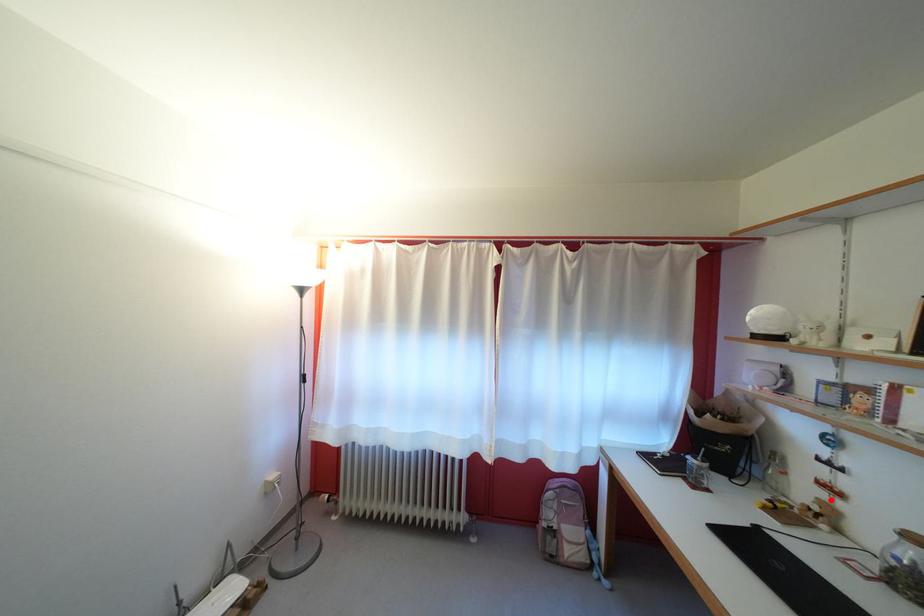
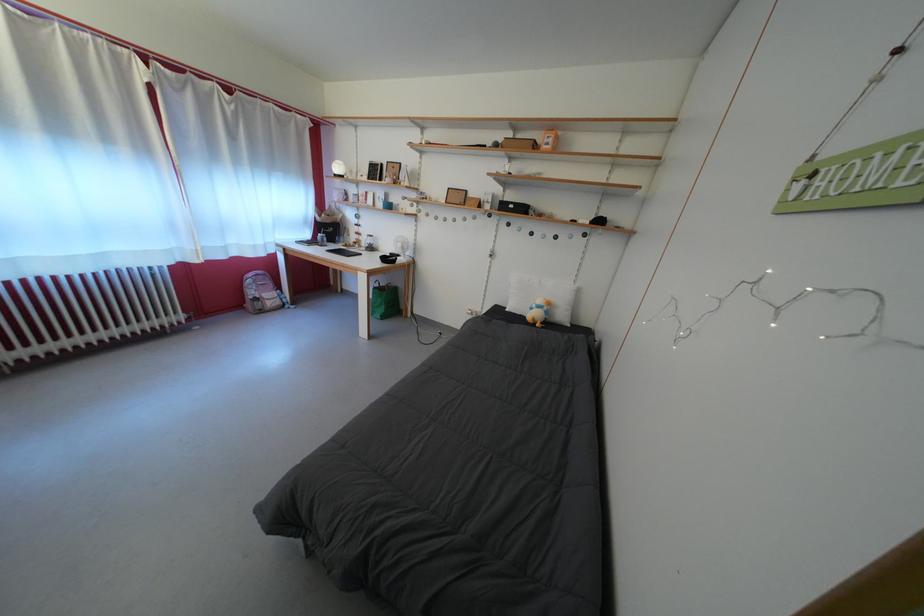
Question: I am providing you with two images of the same scene from different viewpoints. A red point is marked on the first image. At the location where the point appears in image 1, is it still visible in image 2?

Choices:
 (A) Yes
 (B) No

Answer: (A)